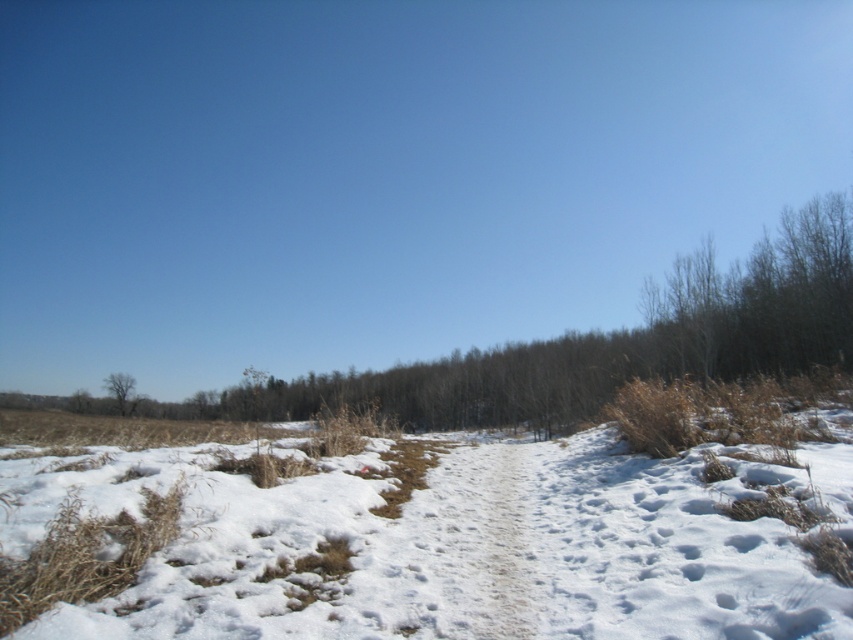
In the scene shown: You are an explorer trying to navigate through the winter landscape. You see the white fluffy snow at center and the brown rough tree at lower left. Which object is higher in the image?

The white fluffy snow at center is located above the brown rough tree at lower left, so it is higher in the image.

You are standing at the starting point of the path in the winter landscape. There are two points marked on the image, point A at coordinates point A is point (x=457, y=467) and point B at coordinates point B is point (x=126, y=378). Which point is closer to you as you stand at the path entrance?

Point A at coordinates point A is point (x=457, y=467) is closer to you because it is in front of point B at coordinates point B is point (x=126, y=378).

You are a hiker standing at the brown rough tree at lower left and want to reach the white fluffy snow at center. Which direction should you move to get there?

The white fluffy snow at center is to the right of the brown rough tree at lower left, so you should move to the right to reach it.